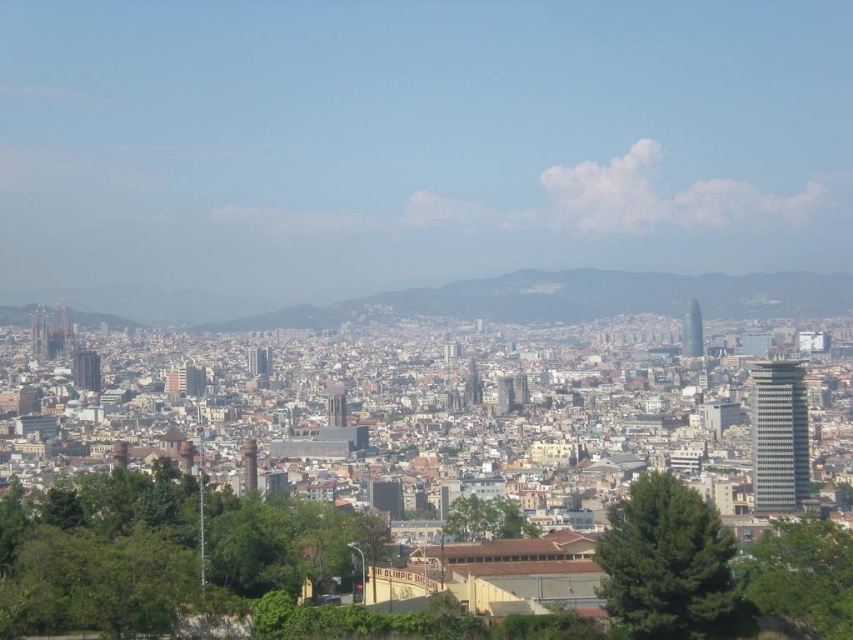
You are a drone operator flying a drone that can only fly horizontally. You need to capture a photo of the green textured tree at center without the green leafy tree at lower right blocking the view. Is this possible?

The green textured tree at center is positioned over the green leafy tree at lower right, so flying the drone horizontally might still result in the lower tree blocking the view. Adjust the drone to a higher altitude or angle to ensure the green textured tree at center is fully visible without obstruction.

You are a city planner analyzing this urban area. You need to install a new public bench that is 2 meters long. The bench must be placed equidistant between the green leafy tree at lower right and the green leafy tree at center. Is there enough space for the bench to be placed between them?

The distance between the green leafy tree at lower right and green leafy tree at center is 81.23 meters. Since the bench is only 2 meters long, there is ample space to place it equidistant between them.